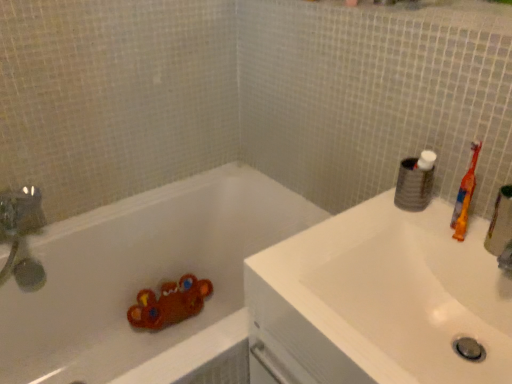
Question: Is orange plastic toothbrush at right closer to camera compared to white glossy sink at upper right?

Choices:
 (A) yes
 (B) no

Answer: (B)

Question: From the image's perspective, is orange plastic toothbrush at right under white glossy sink at upper right?

Choices:
 (A) no
 (B) yes

Answer: (A)

Question: Is orange plastic toothbrush at right at the left side of white glossy sink at upper right?

Choices:
 (A) no
 (B) yes

Answer: (A)

Question: Is orange plastic toothbrush at right bigger than white glossy sink at upper right?

Choices:
 (A) no
 (B) yes

Answer: (A)

Question: From a real-world perspective, is orange plastic toothbrush at right over white glossy sink at upper right?

Choices:
 (A) no
 (B) yes

Answer: (B)

Question: From the image's perspective, is orange plastic toothbrush at right located above white glossy sink at upper right?

Choices:
 (A) no
 (B) yes

Answer: (B)

Question: Is white matte bathtub at lower left to the left of white matte toilet paper at upper right from the viewer's perspective?

Choices:
 (A) yes
 (B) no

Answer: (A)

Question: Is white matte bathtub at lower left smaller than white matte toilet paper at upper right?

Choices:
 (A) yes
 (B) no

Answer: (B)

Question: Can you confirm if white matte bathtub at lower left is shorter than white matte toilet paper at upper right?

Choices:
 (A) yes
 (B) no

Answer: (B)

Question: Are white matte bathtub at lower left and white matte toilet paper at upper right located far from each other?

Choices:
 (A) no
 (B) yes

Answer: (A)

Question: Is white matte bathtub at lower left in contact with white matte toilet paper at upper right?

Choices:
 (A) yes
 (B) no

Answer: (B)

Question: Is the depth of white matte bathtub at lower left less than that of white matte toilet paper at upper right?

Choices:
 (A) yes
 (B) no

Answer: (A)

Question: Is white glossy sink at upper right to the left of white matte toilet paper at upper right from the viewer's perspective?

Choices:
 (A) no
 (B) yes

Answer: (B)